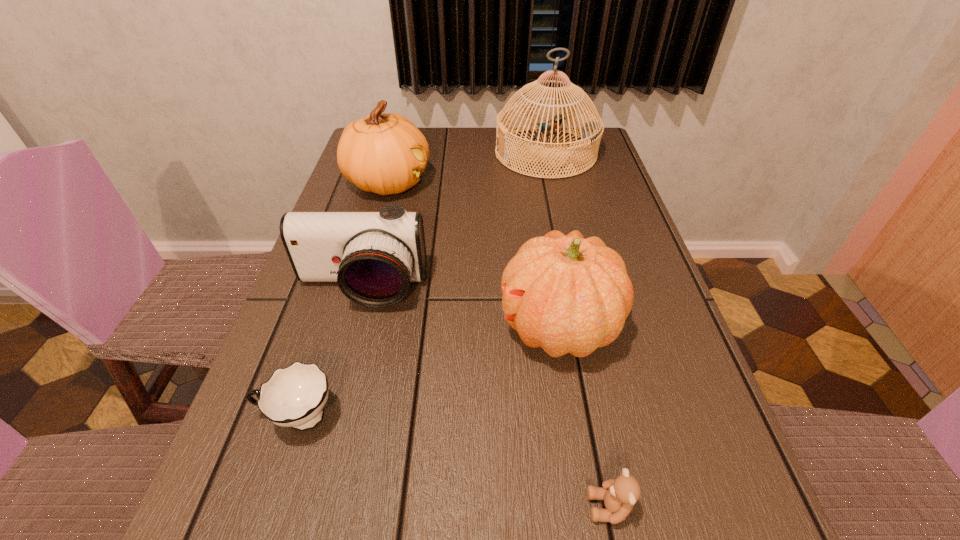
The width and height of the screenshot is (960, 540). Identify the location of birdcage. pos(591,132).

Find the location of a particular element. This screenshot has height=540, width=960. the right pumpkin is located at coordinates (567, 294).

I want to click on the left pumpkin, so click(385, 153).

Locate an element on the screen. The height and width of the screenshot is (540, 960). camcorder is located at coordinates (373, 256).

I want to click on the second nearest object, so click(x=294, y=396).

At what (x,y) coordinates should I click in order to perform the action: click on the nearest object. Please return your answer as a coordinate pair (x, y). Image resolution: width=960 pixels, height=540 pixels. Looking at the image, I should click on (619, 495).

The height and width of the screenshot is (540, 960). In order to click on free space located 0.260m on the left of the birdcage in this screenshot , I will do [x=410, y=153].

At what (x,y) coordinates should I click in order to perform the action: click on vacant area situated on the carved face of the nearer pumpkin. Please return your answer as a coordinate pair (x, y). The image size is (960, 540). Looking at the image, I should click on (464, 327).

Where is `vacant space situated on the carved face of the nearer pumpkin`? The height and width of the screenshot is (540, 960). vacant space situated on the carved face of the nearer pumpkin is located at coordinates (427, 327).

Identify the location of vacant region located 0.210m on the carved face of the nearer pumpkin. The image size is (960, 540). tap(391, 327).